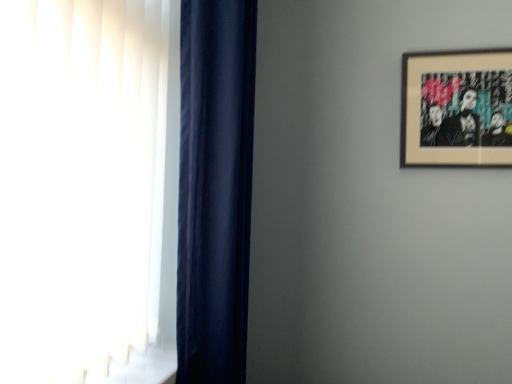
Where is `navy velvet curtain at left`? navy velvet curtain at left is located at coordinates (215, 188).

The image size is (512, 384). What do you see at coordinates (215, 188) in the screenshot?
I see `navy velvet curtain at left` at bounding box center [215, 188].

This screenshot has height=384, width=512. Describe the element at coordinates (457, 108) in the screenshot. I see `wooden-framed artwork at upper right` at that location.

This screenshot has height=384, width=512. Identify the location of wooden-framed artwork at upper right. (457, 108).

Locate an element on the screen. navy velvet curtain at left is located at coordinates (215, 188).

Can you confirm if navy velvet curtain at left is positioned to the right of wooden-framed artwork at upper right?

Incorrect, navy velvet curtain at left is not on the right side of wooden-framed artwork at upper right.

Is navy velvet curtain at left further to camera compared to wooden-framed artwork at upper right?

No, navy velvet curtain at left is closer to the camera.

Is point (241, 139) behind point (497, 96)?

No, it is not.

From the image's perspective, relative to wooden-framed artwork at upper right, is navy velvet curtain at left above or below?

Based on their image positions, navy velvet curtain at left is located beneath wooden-framed artwork at upper right.

From a real-world perspective, which is physically above, navy velvet curtain at left or wooden-framed artwork at upper right?

From a 3D spatial view, wooden-framed artwork at upper right is above.

Considering the sizes of objects navy velvet curtain at left and wooden-framed artwork at upper right in the image provided, who is wider, navy velvet curtain at left or wooden-framed artwork at upper right?

Wider between the two is navy velvet curtain at left.

Which of these two, navy velvet curtain at left or wooden-framed artwork at upper right, stands taller?

navy velvet curtain at left is taller.

Is navy velvet curtain at left bigger than wooden-framed artwork at upper right?

Correct, navy velvet curtain at left is larger in size than wooden-framed artwork at upper right.

Is navy velvet curtain at left outside of wooden-framed artwork at upper right?

navy velvet curtain at left lies outside wooden-framed artwork at upper right's area.

Is the surface of navy velvet curtain at left in direct contact with wooden-framed artwork at upper right?

No.

Is navy velvet curtain at left positioned with its back to wooden-framed artwork at upper right?

navy velvet curtain at left is not turned away from wooden-framed artwork at upper right.

How different are the orientations of navy velvet curtain at left and wooden-framed artwork at upper right in degrees?

The angle between the facing direction of navy velvet curtain at left and the facing direction of wooden-framed artwork at upper right is 90.6 degrees.

How distant is navy velvet curtain at left from wooden-framed artwork at upper right?

navy velvet curtain at left and wooden-framed artwork at upper right are 82.11 centimeters apart.

Identify the location of curtain below the wooden-framed artwork at upper right (from the image's perspective). (215, 188).

Which is more to the left, wooden-framed artwork at upper right or navy velvet curtain at left?

From the viewer's perspective, navy velvet curtain at left appears more on the left side.

Considering the positions of objects wooden-framed artwork at upper right and navy velvet curtain at left in the image provided, who is in front, wooden-framed artwork at upper right or navy velvet curtain at left?

navy velvet curtain at left is more forward.

Which is behind, point (485, 101) or point (243, 232)?

Positioned behind is point (485, 101).

From the image's perspective, would you say wooden-framed artwork at upper right is shown under navy velvet curtain at left?

No, from the image's perspective, wooden-framed artwork at upper right is not below navy velvet curtain at left.

From a real-world perspective, is wooden-framed artwork at upper right on navy velvet curtain at left?

Yes, from a real-world perspective, wooden-framed artwork at upper right is over navy velvet curtain at left

Can you confirm if wooden-framed artwork at upper right is thinner than navy velvet curtain at left?

Indeed, wooden-framed artwork at upper right has a lesser width compared to navy velvet curtain at left.

Is wooden-framed artwork at upper right taller or shorter than navy velvet curtain at left?

wooden-framed artwork at upper right is shorter than navy velvet curtain at left.

Considering the sizes of objects wooden-framed artwork at upper right and navy velvet curtain at left in the image provided, who is bigger, wooden-framed artwork at upper right or navy velvet curtain at left?

navy velvet curtain at left is bigger.

Is wooden-framed artwork at upper right completely or partially outside of navy velvet curtain at left?

Indeed, wooden-framed artwork at upper right is completely outside navy velvet curtain at left.

Is wooden-framed artwork at upper right next to navy velvet curtain at left and touching it?

No, wooden-framed artwork at upper right is not next to navy velvet curtain at left.

Is wooden-framed artwork at upper right oriented away from navy velvet curtain at left?

That's not correct — wooden-framed artwork at upper right is not looking away from navy velvet curtain at left.

How different are the orientations of wooden-framed artwork at upper right and navy velvet curtain at left in degrees?

They differ by 90.6 degrees in their facing directions.

Measure the distance between wooden-framed artwork at upper right and navy velvet curtain at left.

wooden-framed artwork at upper right and navy velvet curtain at left are 32.32 inches apart from each other.

You are a GUI agent. You are given a task and a screenshot of the screen. Output one action in this format:
    pyautogui.click(x=<x>, y=<y>)
    Task: Click on the picture frame located behind the navy velvet curtain at left
    Image resolution: width=512 pixels, height=384 pixels.
    Given the screenshot: What is the action you would take?
    pyautogui.click(x=457, y=108)

Image resolution: width=512 pixels, height=384 pixels. Find the location of `picture frame that is above the navy velvet curtain at left (from the image's perspective)`. picture frame that is above the navy velvet curtain at left (from the image's perspective) is located at coordinates (457, 108).

You are a GUI agent. You are given a task and a screenshot of the screen. Output one action in this format:
    pyautogui.click(x=<x>, y=<y>)
    Task: Click on the curtain on the left of the wooden-framed artwork at upper right
    The height and width of the screenshot is (384, 512).
    Given the screenshot: What is the action you would take?
    pyautogui.click(x=215, y=188)